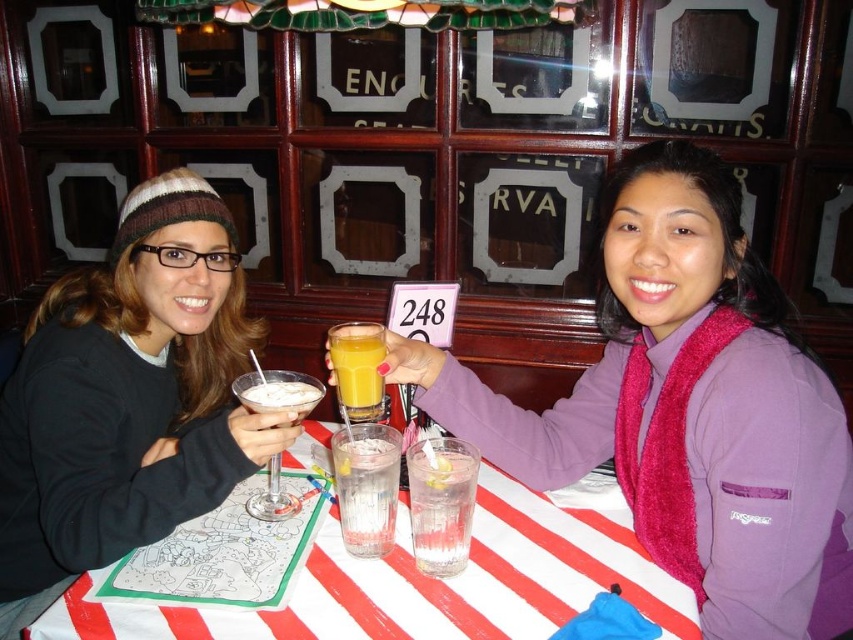
Is matte chocolate martini glass at center bigger than orange matte glass at center?

Correct, matte chocolate martini glass at center is larger in size than orange matte glass at center.

Is matte chocolate martini glass at center to the right of orange matte glass at center from the viewer's perspective?

No, matte chocolate martini glass at center is not to the right of orange matte glass at center.

Between point (271, 481) and point (357, 323), which one is positioned behind?

Positioned behind is point (271, 481).

Image resolution: width=853 pixels, height=640 pixels. I want to click on matte chocolate martini glass at center, so coord(277,392).

This screenshot has width=853, height=640. Describe the element at coordinates (128, 397) in the screenshot. I see `matte black beanie at left` at that location.

At what (x,y) coordinates should I click in order to perform the action: click on matte black beanie at left. Please return your answer as a coordinate pair (x, y). This screenshot has width=853, height=640. Looking at the image, I should click on (128, 397).

Which is more to the left, clear glass at center or matte chocolate martini glass at center?

Positioned to the left is matte chocolate martini glass at center.

Who is lower down, clear glass at center or matte chocolate martini glass at center?

Positioned lower is clear glass at center.

The width and height of the screenshot is (853, 640). In order to click on clear glass at center in this screenshot , I will do `click(366, 486)`.